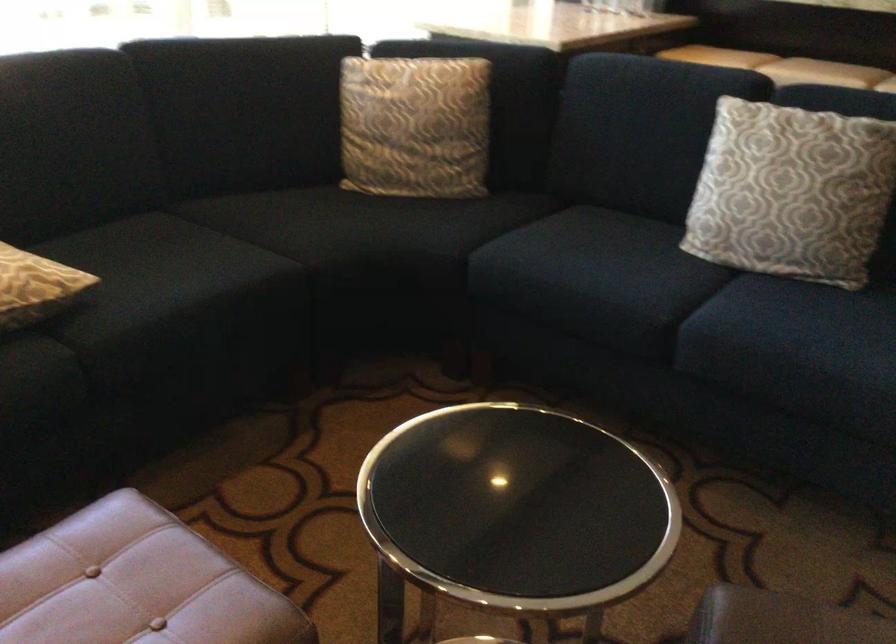
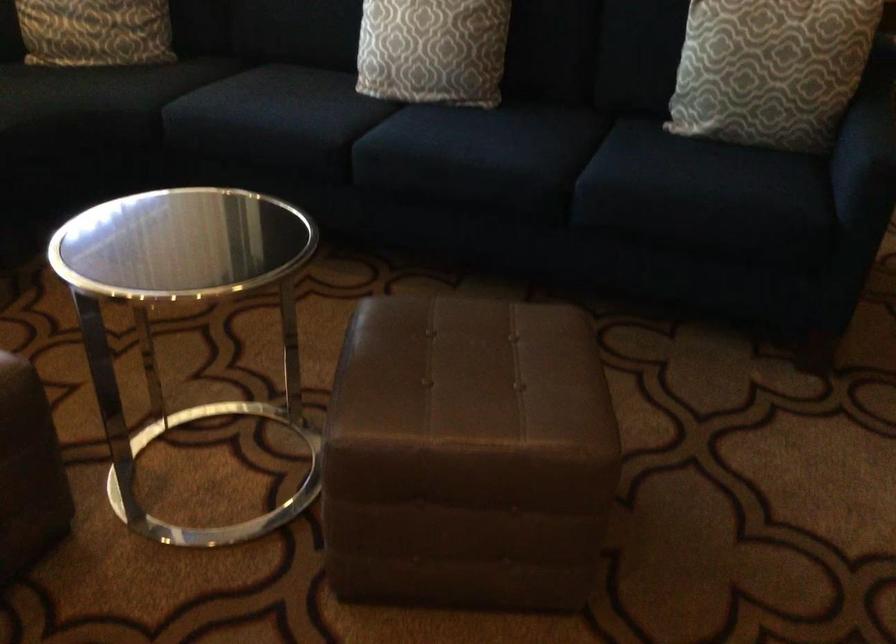
Question: The camera is either moving clockwise (left) or counter-clockwise (right) around the object. The first image is from the beginning of the video and the second image is from the end. Is the camera moving left or right when shooting the video?

Choices:
 (A) Left
 (B) Right

Answer: (A)